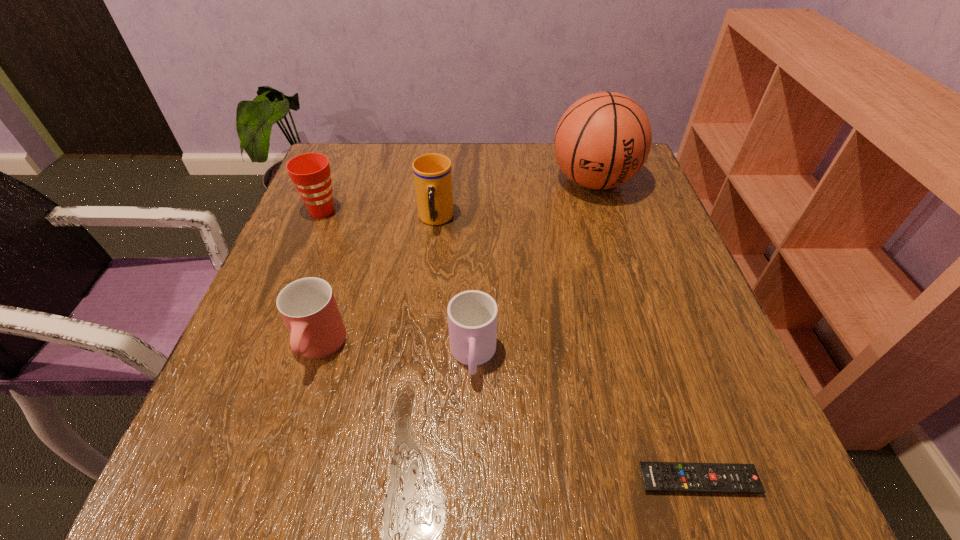
Where is `free space located on the side of the fifth object from right to left with the handle`? This screenshot has width=960, height=540. free space located on the side of the fifth object from right to left with the handle is located at coordinates (295, 427).

Find the location of a particular element. The width and height of the screenshot is (960, 540). free space located 0.110m with the handle on the side of the third object from right to left is located at coordinates (471, 457).

Where is `free space located 0.070m on the back of the nearest object`? The width and height of the screenshot is (960, 540). free space located 0.070m on the back of the nearest object is located at coordinates (678, 417).

Where is `object present at the far edge`? object present at the far edge is located at coordinates (603, 139).

At what (x,y) coordinates should I click in order to perform the action: click on object that is at the near edge. Please return your answer as a coordinate pair (x, y). This screenshot has width=960, height=540. Looking at the image, I should click on (657, 476).

I want to click on basketball present at the right edge, so click(x=603, y=139).

Find the location of a particular element. remote control that is at the right edge is located at coordinates (657, 476).

Identify the location of object that is at the far right corner. (603, 139).

The width and height of the screenshot is (960, 540). I want to click on object positioned at the near right corner, so click(657, 476).

In the image, there is a desktop. Where is `vacant space at the far edge`? vacant space at the far edge is located at coordinates (381, 190).